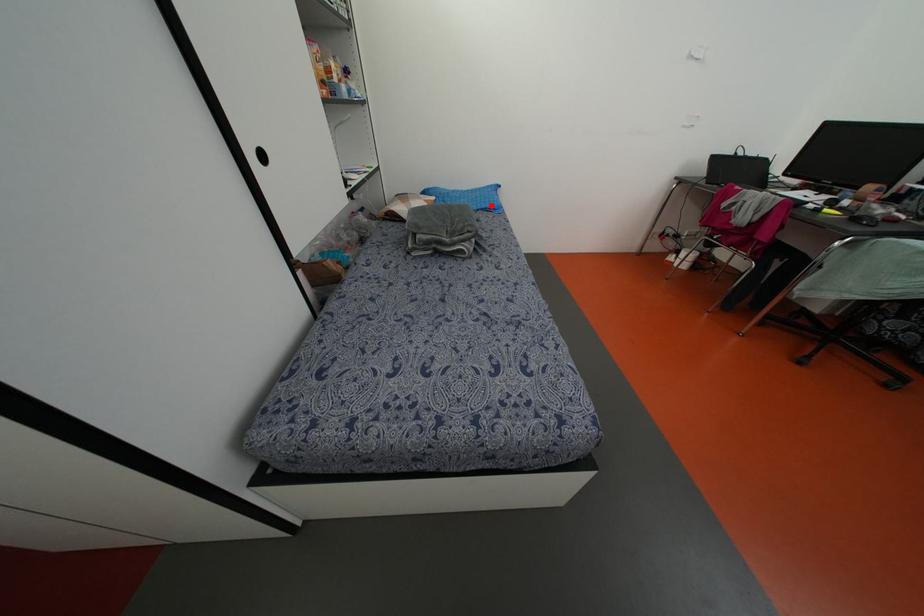
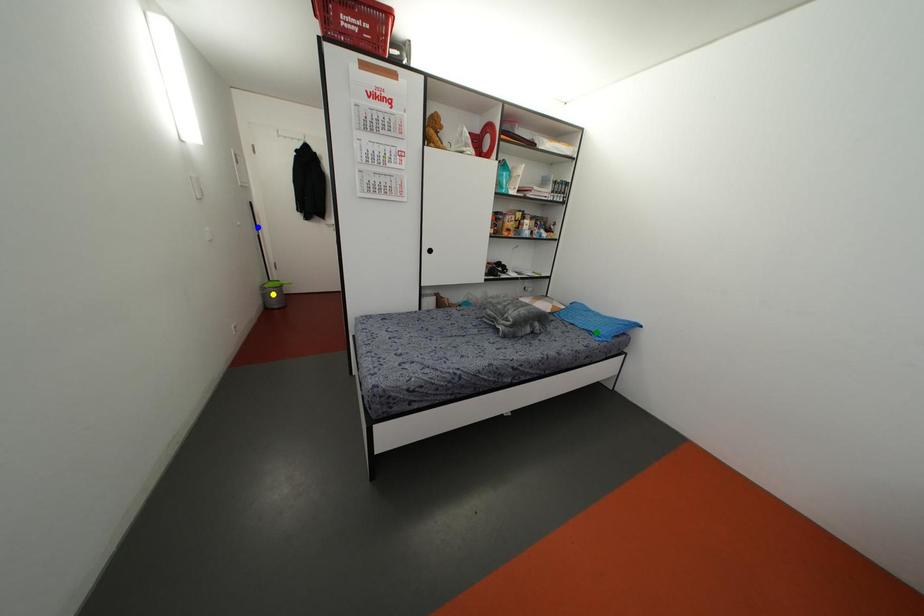
Question: I am providing you with two images of the same scene from different viewpoints. A red point is marked on the first image. You are given multiple points on the second image. Which mark in image 2 goes with the point in image 1?

Choices:
 (A) yellow point
 (B) blue point
 (C) green point

Answer: (C)